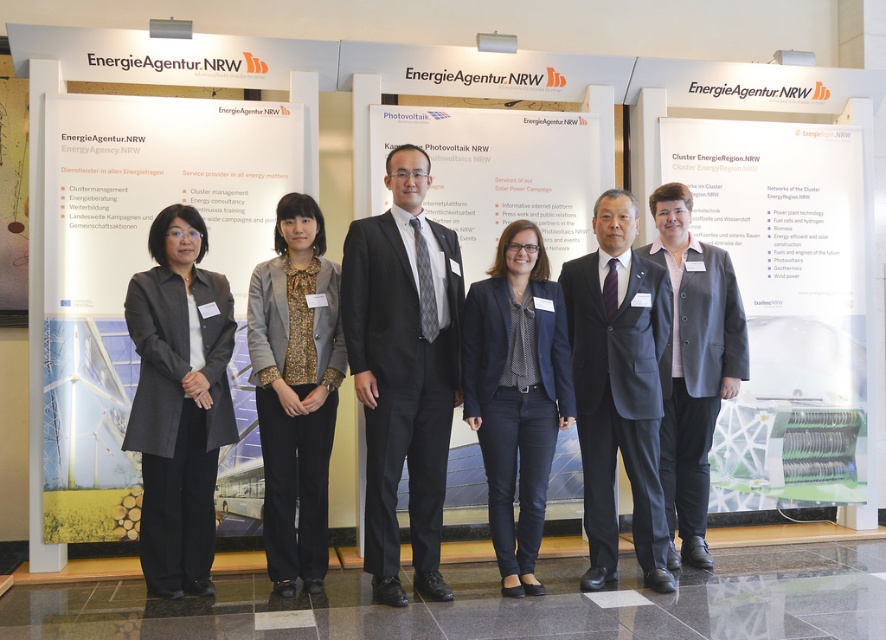
Who is positioned more to the right, green matte solar panel at center or navy blue suit at center?

Positioned to the right is green matte solar panel at center.

Is green matte solar panel at center smaller than navy blue suit at center?

Incorrect, green matte solar panel at center is not smaller in size than navy blue suit at center.

The height and width of the screenshot is (640, 886). Identify the location of green matte solar panel at center. coord(785,300).

Where is `green matte solar panel at center`? green matte solar panel at center is located at coordinates (785, 300).

Is matte white poster at left to the left of dark gray matte blazer at center from the viewer's perspective?

Correct, you'll find matte white poster at left to the left of dark gray matte blazer at center.

At what (x,y) coordinates should I click in order to perform the action: click on matte white poster at left. Please return your answer as a coordinate pair (x, y). Looking at the image, I should click on (144, 269).

What do you see at coordinates (144, 269) in the screenshot?
I see `matte white poster at left` at bounding box center [144, 269].

Where is `matte white poster at left`? The width and height of the screenshot is (886, 640). matte white poster at left is located at coordinates (144, 269).

Is green matte solar panel at center above dark gray wool suit at center?

Yes.

From the picture: Who is positioned more to the right, green matte solar panel at center or dark gray wool suit at center?

green matte solar panel at center

Is point (735, 406) closer to viewer compared to point (659, 428)?

That is False.

The width and height of the screenshot is (886, 640). I want to click on green matte solar panel at center, so click(x=785, y=300).